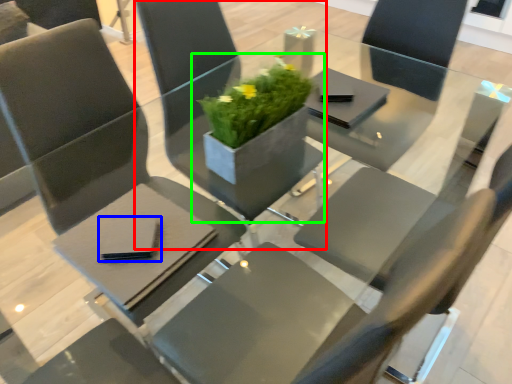
Question: Considering the real-world distances, which object is closest to chair (highlighted by a red box)? pad (highlighted by a blue box) or houseplant (highlighted by a green box).

Choices:
 (A) pad
 (B) houseplant

Answer: (B)